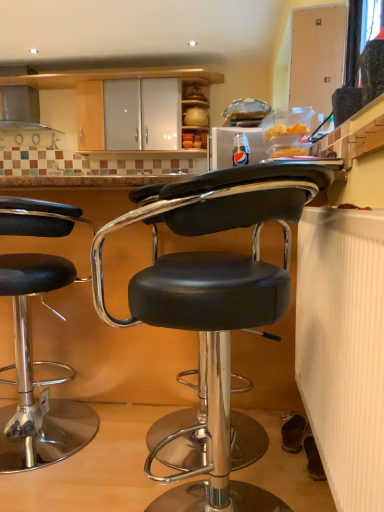
Question: From the image's perspective, is black leather stool at left, which is the 1th chair in back-to-front order, above or below satin silver exhaust hood at upper left?

Choices:
 (A) above
 (B) below

Answer: (B)

Question: Is black leather stool at left, acting as the 2th chair starting from the right, in front of or behind satin silver exhaust hood at upper left in the image?

Choices:
 (A) front
 (B) behind

Answer: (A)

Question: Estimate the real-world distances between objects in this image. Which object is farther from the satin silver exhaust hood at upper left?

Choices:
 (A) black leather stool at center, arranged as the 1th chair when viewed from the front
 (B) black leather stool at left, placed as the 1th chair when sorted from left to right

Answer: (A)

Question: Which object is positioned farthest from the black leather stool at left, which ranks as the 2th chair in front-to-back order?

Choices:
 (A) satin silver exhaust hood at upper left
 (B) black leather stool at center, arranged as the 1th chair when viewed from the front

Answer: (A)